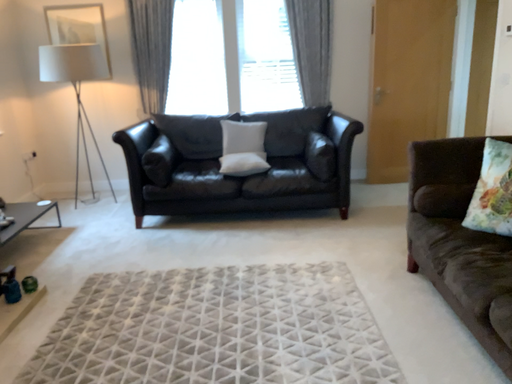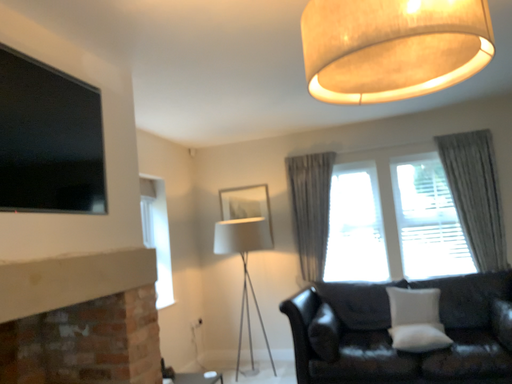
Question: How did the camera likely rotate when shooting the video?

Choices:
 (A) rotated upward
 (B) rotated downward

Answer: (A)